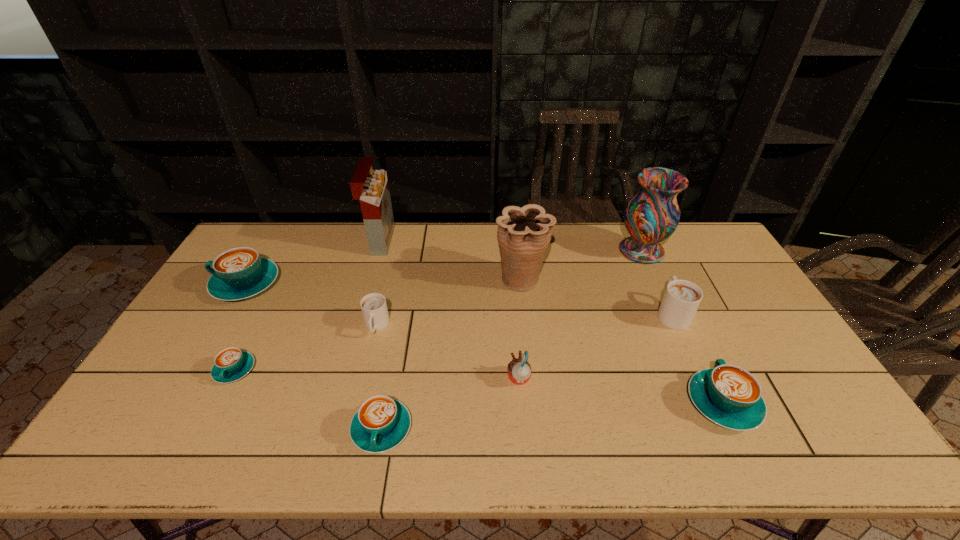
You are a GUI agent. You are given a task and a screenshot of the screen. Output one action in this format:
    pyautogui.click(x=<x>, y=<y>)
    Task: Click on the shortest object
    The image size is (960, 540).
    Given the screenshot: What is the action you would take?
    (x=231, y=364)

Find the location of `the smallest turquoise cappuccino`. the smallest turquoise cappuccino is located at coordinates (231, 364).

Image resolution: width=960 pixels, height=540 pixels. In order to click on free space located with the lid open on the cigarette case in this screenshot , I will do `click(456, 241)`.

Where is `vacant point located 0.200m on the right of the vase`? This screenshot has height=540, width=960. vacant point located 0.200m on the right of the vase is located at coordinates (722, 251).

Find the location of `vacant space located on the back of the eighth shortest object`. vacant space located on the back of the eighth shortest object is located at coordinates (516, 232).

Find the location of a particular element. The image size is (960, 540). blank area located 0.080m on the side with the handle of the bigger white cappuccino is located at coordinates (657, 280).

The height and width of the screenshot is (540, 960). In order to click on blank space located 0.220m on the side with the handle of the bigger white cappuccino in this screenshot , I will do `click(644, 254)`.

At what (x,y) coordinates should I click in order to perform the action: click on free space located 0.220m on the side with the handle of the bigger white cappuccino. Please return your answer as a coordinate pair (x, y). The width and height of the screenshot is (960, 540). Looking at the image, I should click on (644, 254).

This screenshot has height=540, width=960. Identify the location of free space located on the front-facing side of the pink muffin. (367, 379).

At what (x,y) coordinates should I click in order to perform the action: click on free space located 0.290m on the front-facing side of the pink muffin. Please return your answer as a coordinate pair (x, y). Looking at the image, I should click on (397, 379).